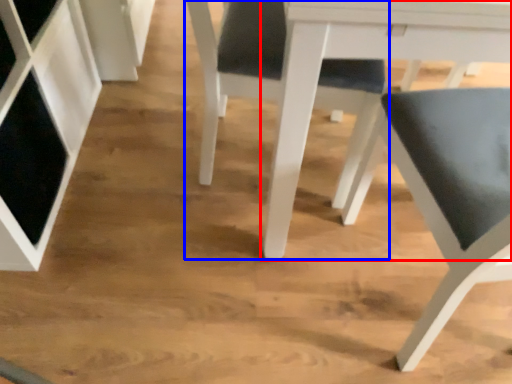
Question: Which object appears closest to the camera in this image, table (highlighted by a red box) or chair (highlighted by a blue box)?

Choices:
 (A) table
 (B) chair

Answer: (A)